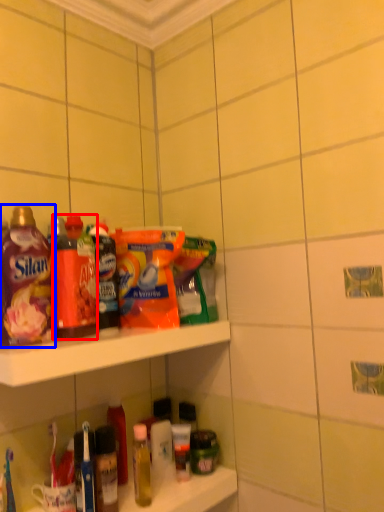
Question: Which object appears farthest to the camera in this image, bottle (highlighted by a red box) or bottle (highlighted by a blue box)?

Choices:
 (A) bottle
 (B) bottle

Answer: (A)